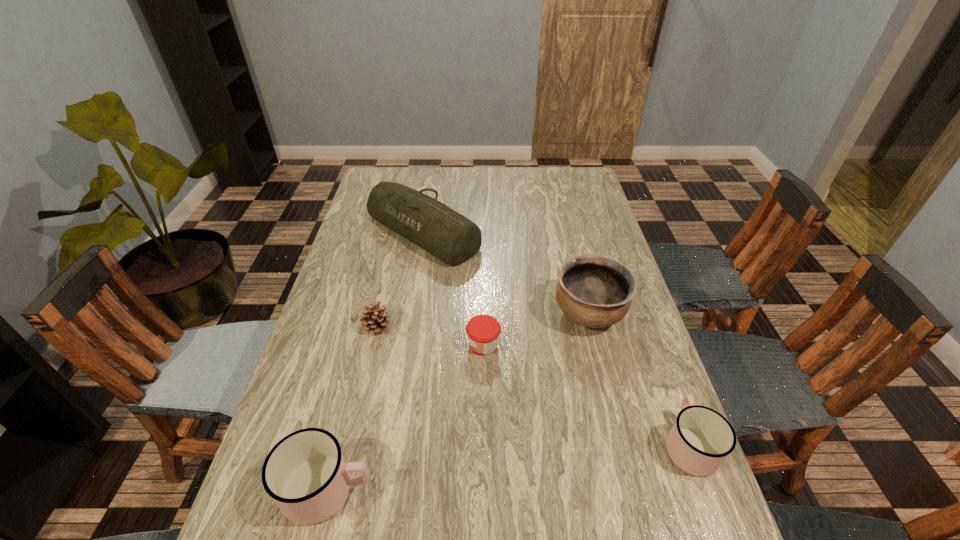
Find the location of `the taller mug`. the taller mug is located at coordinates (305, 473).

Find the location of a particular element. The height and width of the screenshot is (540, 960). the left mug is located at coordinates pos(305,473).

This screenshot has width=960, height=540. In order to click on the shorter mug in this screenshot , I will do `click(700, 440)`.

Find the location of a particular element. Image resolution: width=960 pixels, height=540 pixels. jam is located at coordinates (483, 331).

You are a GUI agent. You are given a task and a screenshot of the screen. Output one action in this format:
    pyautogui.click(x=<x>, y=<y>)
    Task: Click on the pottery
    Image resolution: width=960 pixels, height=540 pixels.
    Given the screenshot: What is the action you would take?
    pyautogui.click(x=595, y=291)

Locate an element on the screen. The height and width of the screenshot is (540, 960). duffel bag is located at coordinates (446, 234).

The image size is (960, 540). What are the coordinates of `pinecone` in the screenshot? It's located at (373, 318).

Find the location of a particular element. This screenshot has width=960, height=540. vacant space located 0.050m on the side of the third tallest object with the handle is located at coordinates (398, 490).

Locate an element on the screen. Image resolution: width=960 pixels, height=540 pixels. vacant space situated on the side of the right mug with the handle is located at coordinates (663, 374).

The image size is (960, 540). What are the coordinates of `free region located 0.070m on the side of the right mug with the handle` in the screenshot? It's located at (668, 388).